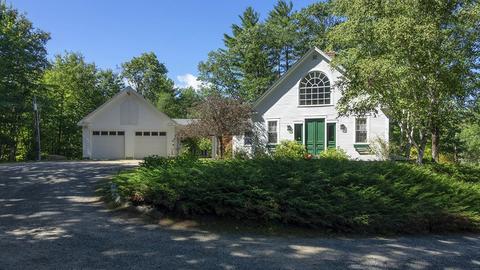
Where is `light`? The image size is (480, 270). light is located at coordinates (288, 127), (346, 129).